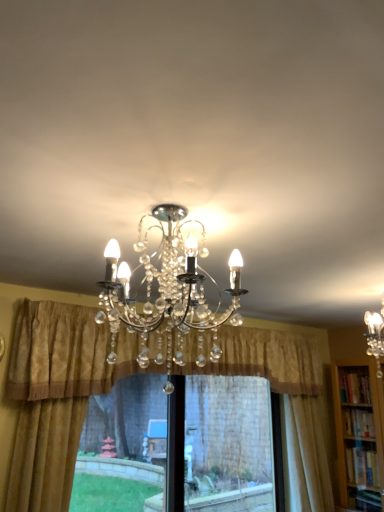
Question: Could transparent plastic window screen at center be considered to be inside gold textured curtain at center, which ranks as the second curtain in right-to-left order?

Choices:
 (A) no
 (B) yes

Answer: (A)

Question: Is transparent plastic window screen at center at the back of gold textured curtain at center, the second curtain viewed from the left?

Choices:
 (A) yes
 (B) no

Answer: (B)

Question: Could you tell me if gold textured curtain at center, which ranks as the second curtain in right-to-left order, is facing transparent plastic window screen at center?

Choices:
 (A) yes
 (B) no

Answer: (B)

Question: Is gold textured curtain at center, which ranks as the second curtain in right-to-left order, not within transparent plastic window screen at center?

Choices:
 (A) no
 (B) yes

Answer: (B)

Question: Is gold textured curtain at center, which ranks as the second curtain in right-to-left order, at the right side of transparent plastic window screen at center?

Choices:
 (A) no
 (B) yes

Answer: (A)

Question: Does gold textured curtain at center, the second curtain viewed from the left, have a smaller size compared to transparent plastic window screen at center?

Choices:
 (A) yes
 (B) no

Answer: (B)

Question: Is gold textured curtain at center, which ranks as the second curtain in right-to-left order, shorter than green grass at lower left?

Choices:
 (A) no
 (B) yes

Answer: (B)

Question: From a real-world perspective, is gold textured curtain at center, the second curtain viewed from the left, physically below green grass at lower left?

Choices:
 (A) yes
 (B) no

Answer: (B)

Question: From a real-world perspective, is gold textured curtain at center, which ranks as the second curtain in right-to-left order, positioned over green grass at lower left based on gravity?

Choices:
 (A) no
 (B) yes

Answer: (B)

Question: From the image's perspective, would you say gold textured curtain at center, which ranks as the second curtain in right-to-left order, is shown under green grass at lower left?

Choices:
 (A) no
 (B) yes

Answer: (A)

Question: Is gold textured curtain at center, which ranks as the second curtain in right-to-left order, closer to the viewer compared to green grass at lower left?

Choices:
 (A) no
 (B) yes

Answer: (B)

Question: Is gold textured curtain at center, which ranks as the second curtain in right-to-left order, looking in the opposite direction of green grass at lower left?

Choices:
 (A) no
 (B) yes

Answer: (A)

Question: Is gold textured curtain at left, marked as the first curtain in a left-to-right arrangement, shorter than clear crystal chandelier at center?

Choices:
 (A) yes
 (B) no

Answer: (B)